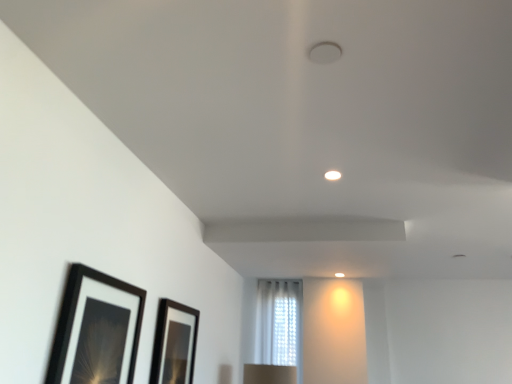
Question: Does white sheer curtain at center appear on the left side of black glossy picture frame at lower center, which ranks as the 1th picture frame in back-to-front order?

Choices:
 (A) yes
 (B) no

Answer: (B)

Question: Is white sheer curtain at center bigger than black glossy picture frame at lower center, which is the second picture frame in left-to-right order?

Choices:
 (A) no
 (B) yes

Answer: (B)

Question: Can you confirm if white sheer curtain at center is thinner than black glossy picture frame at lower center, which is the second picture frame in left-to-right order?

Choices:
 (A) yes
 (B) no

Answer: (B)

Question: Can you confirm if white sheer curtain at center is shorter than black glossy picture frame at lower center, which is the second picture frame in left-to-right order?

Choices:
 (A) no
 (B) yes

Answer: (A)

Question: Is white sheer curtain at center outside of black glossy picture frame at lower center, arranged as the second picture frame when viewed from the front?

Choices:
 (A) no
 (B) yes

Answer: (B)

Question: Does white sheer curtain at center have a smaller size compared to black glossy picture frame at lower center, arranged as the second picture frame when viewed from the front?

Choices:
 (A) no
 (B) yes

Answer: (A)

Question: Is black matte picture frame at lower left, placed as the 2th picture frame when sorted from right to left, further to the viewer compared to black glossy picture frame at lower center, arranged as the second picture frame when viewed from the front?

Choices:
 (A) yes
 (B) no

Answer: (B)

Question: Is black matte picture frame at lower left, positioned as the first picture frame in left-to-right order, not close to black glossy picture frame at lower center, which is the second picture frame in left-to-right order?

Choices:
 (A) yes
 (B) no

Answer: (B)

Question: Is black matte picture frame at lower left, placed as the 2th picture frame when sorted from right to left, bigger than black glossy picture frame at lower center, arranged as the second picture frame when viewed from the front?

Choices:
 (A) yes
 (B) no

Answer: (A)

Question: Is black matte picture frame at lower left, which ranks as the second picture frame in back-to-front order, closer to camera compared to black glossy picture frame at lower center, arranged as the second picture frame when viewed from the front?

Choices:
 (A) yes
 (B) no

Answer: (A)

Question: Does black matte picture frame at lower left, which ranks as the second picture frame in back-to-front order, have a lesser width compared to black glossy picture frame at lower center, which is the second picture frame in left-to-right order?

Choices:
 (A) yes
 (B) no

Answer: (B)

Question: Is black glossy picture frame at lower center, arranged as the second picture frame when viewed from the front, at the back of black matte picture frame at lower left, which is counted as the first picture frame, starting from the front?

Choices:
 (A) no
 (B) yes

Answer: (A)

Question: Is black matte picture frame at lower left, placed as the 2th picture frame when sorted from right to left, wider than white sheer curtain at center?

Choices:
 (A) yes
 (B) no

Answer: (B)